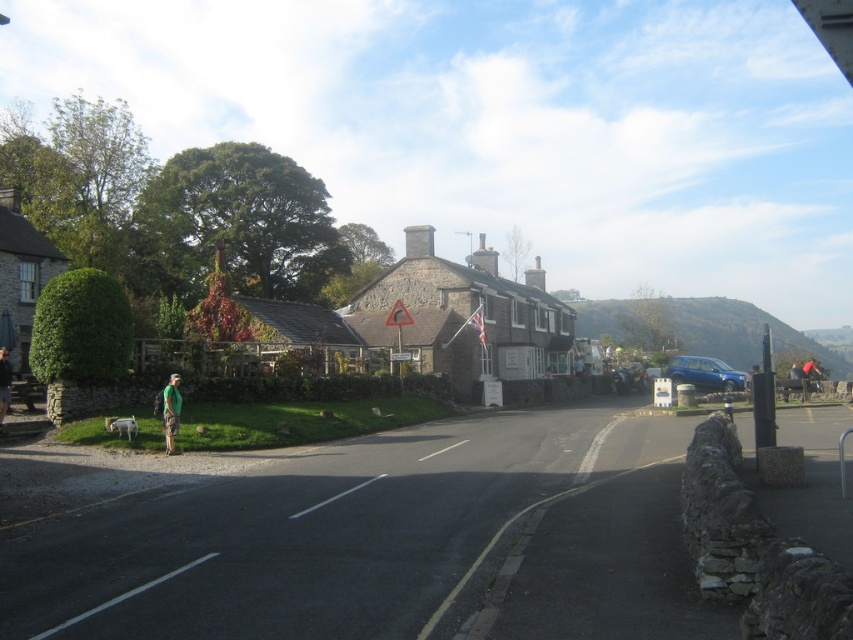
You are a pedestrian standing on the grassy area near the stone wall. You want to walk to the stone house at center. Which direction should you move relative to the green fabric shirt at lower left?

The stone house at center is above the green fabric shirt at lower left, so you should move upward towards the stone house at center.